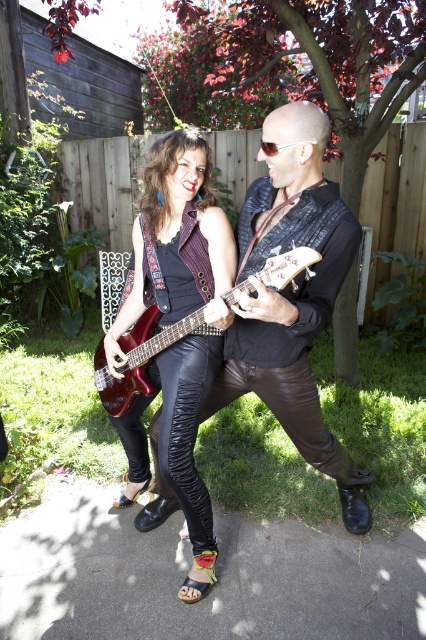
Question: In this image, where is shiny black guitar at center located relative to metallic red electric guitar at center?

Choices:
 (A) above
 (B) below

Answer: (B)

Question: Can you confirm if shiny black leather pants at center is positioned above metallic red electric guitar at center?

Choices:
 (A) yes
 (B) no

Answer: (B)

Question: Which object is farther from the camera taking this photo?

Choices:
 (A) shiny black guitar at center
 (B) shiny black leather pants at center

Answer: (B)

Question: Is shiny black guitar at center above shiny black leather pants at center?

Choices:
 (A) yes
 (B) no

Answer: (B)

Question: Which point is farther to the camera?

Choices:
 (A) shiny black leather pants at center
 (B) shiny black guitar at center
 (C) metallic red electric guitar at center

Answer: (A)

Question: Which point is farther from the camera taking this photo?

Choices:
 (A) (319, 212)
 (B) (207, 282)
 (C) (290, 252)

Answer: (B)